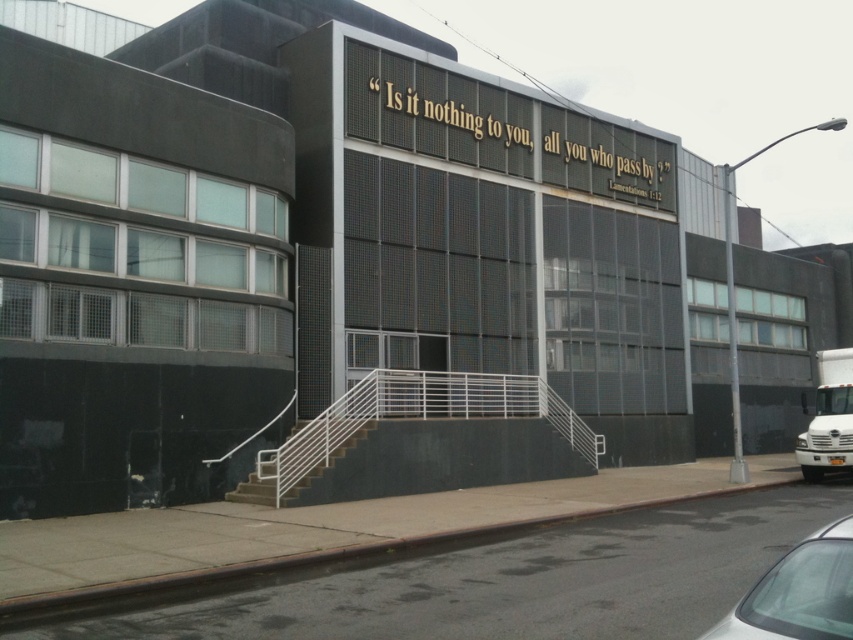
In the scene shown: Is silver metallic car at lower right shorter than concrete stairs at center?

Correct, silver metallic car at lower right is not as tall as concrete stairs at center.

Who is lower down, silver metallic car at lower right or concrete stairs at center?

concrete stairs at center

The width and height of the screenshot is (853, 640). What are the coordinates of `silver metallic car at lower right` in the screenshot? It's located at (799, 593).

Identify the location of silver metallic car at lower right. Image resolution: width=853 pixels, height=640 pixels. (799, 593).